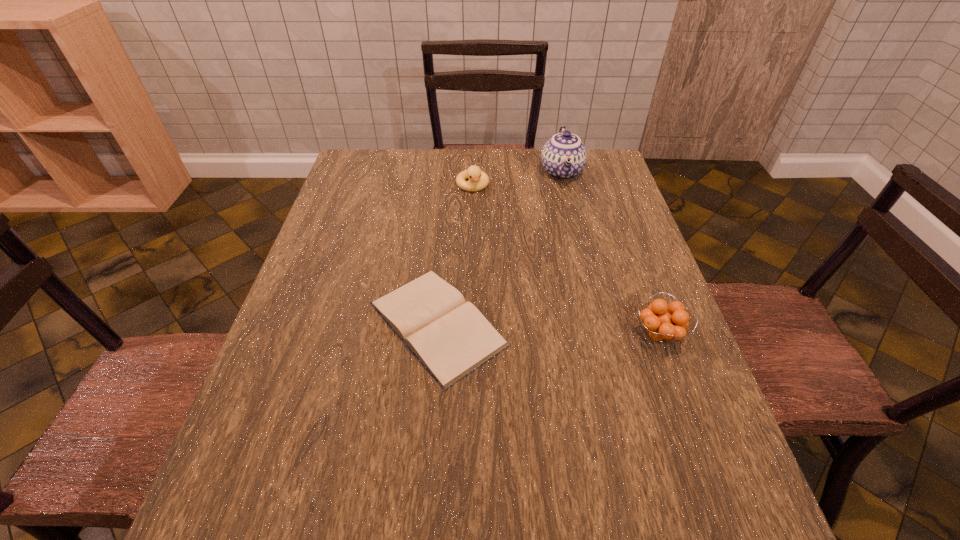
In order to click on free space between the duckling and the chinaware in this screenshot , I will do click(x=517, y=179).

At what (x,y) coordinates should I click in order to perform the action: click on blank region between the Bible and the orange fruit. Please return your answer as a coordinate pair (x, y). The height and width of the screenshot is (540, 960). Looking at the image, I should click on (548, 329).

Find the location of a particular element. The height and width of the screenshot is (540, 960). vacant space that is in between the orange fruit and the Bible is located at coordinates (548, 329).

You are a GUI agent. You are given a task and a screenshot of the screen. Output one action in this format:
    pyautogui.click(x=<x>, y=<y>)
    Task: Click on the empty space that is in between the orange fruit and the duckling
    Image resolution: width=960 pixels, height=540 pixels.
    Given the screenshot: What is the action you would take?
    pyautogui.click(x=565, y=260)

Identify which object is the second closest to the Bible. Please provide its 2D coordinates. Your answer should be formatted as a tuple, i.e. [(x, y)], where the tuple contains the x and y coordinates of a point satisfying the conditions above.

[(478, 180)]

Point out which object is positioned as the third nearest to the duckling. Please provide its 2D coordinates. Your answer should be formatted as a tuple, i.e. [(x, y)], where the tuple contains the x and y coordinates of a point satisfying the conditions above.

[(661, 326)]

At what (x,y) coordinates should I click in order to perform the action: click on free space that satisfies the following two spatial constraints: 1. on the back side of the duckling; 2. on the left side of the chinaware. Please return your answer as a coordinate pair (x, y). Looking at the image, I should click on (473, 172).